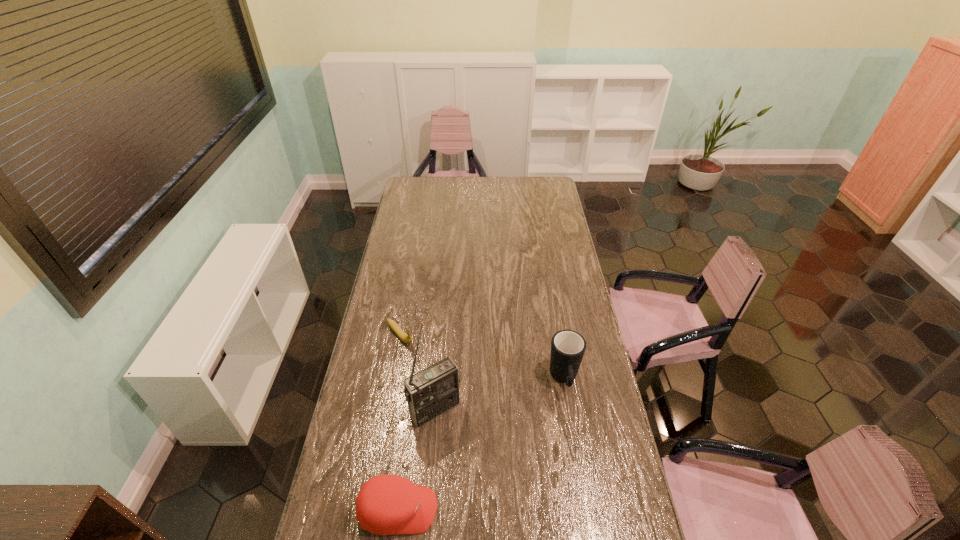
The width and height of the screenshot is (960, 540). I want to click on cap, so click(x=386, y=504).

The height and width of the screenshot is (540, 960). Find the location of `the rightmost object`. the rightmost object is located at coordinates (568, 347).

Identify the location of the third shortest object. This screenshot has height=540, width=960. (568, 347).

Identify the location of radio receiver. (432, 391).

Where is `the farthest object`? The width and height of the screenshot is (960, 540). the farthest object is located at coordinates (407, 339).

You are a GUI agent. You are given a task and a screenshot of the screen. Output one action in this format:
    pyautogui.click(x=<x>, y=<y>)
    Task: Click on the vacant space located on the front-facing side of the nearest object
    
    Given the screenshot: What is the action you would take?
    pyautogui.click(x=462, y=510)

What are the coordinates of `free point located 0.100m on the side of the third shortest object with the handle` in the screenshot? It's located at (571, 425).

Find the location of a particular element. This screenshot has height=540, width=960. free space located on the display of the radio receiver is located at coordinates (499, 500).

Locate an element on the screen. The width and height of the screenshot is (960, 540). free space located on the display of the radio receiver is located at coordinates tap(507, 511).

The width and height of the screenshot is (960, 540). What are the coordinates of `vacant area situated on the display of the radio receiver` in the screenshot? It's located at (465, 448).